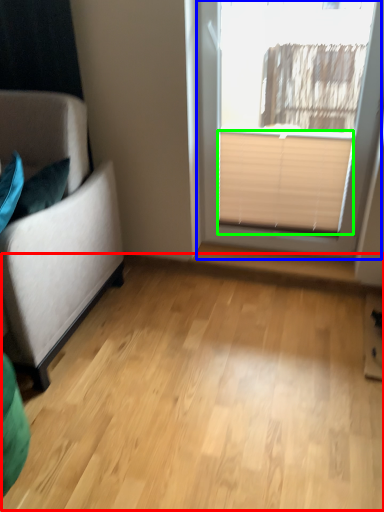
Question: Which object is the farthest from plain (highlighted by a red box)? Choose among these: window (highlighted by a blue box) or blind (highlighted by a green box).

Choices:
 (A) window
 (B) blind

Answer: (A)